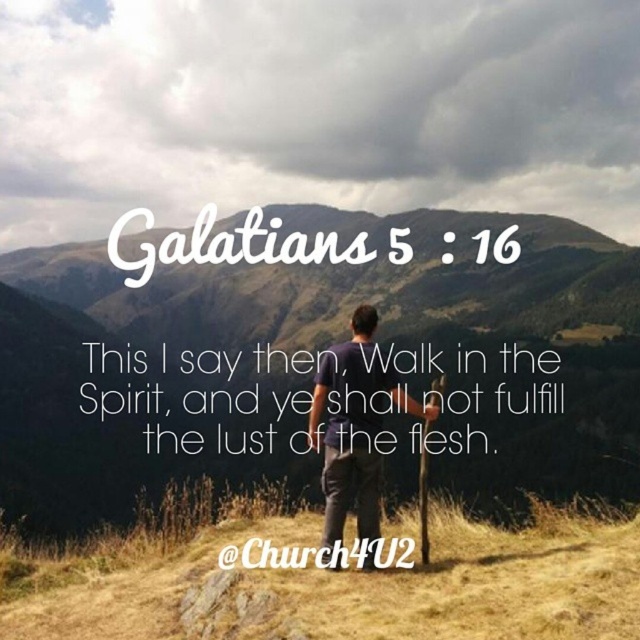
Question: Which object is farther from the camera taking this photo?

Choices:
 (A) dark blue t-shirt at center
 (B) brown grassy hill at center

Answer: (B)

Question: Is brown grassy hill at center above dark blue t-shirt at center?

Choices:
 (A) no
 (B) yes

Answer: (B)

Question: Is brown grassy hill at center smaller than dark blue t-shirt at center?

Choices:
 (A) no
 (B) yes

Answer: (A)

Question: Among these points, which one is nearest to the camera?

Choices:
 (A) (339, 472)
 (B) (209, 349)

Answer: (A)

Question: Which object is farther from the camera taking this photo?

Choices:
 (A) dark blue t-shirt at center
 (B) brown grassy hill at center

Answer: (B)

Question: Is brown grassy hill at center thinner than dark blue t-shirt at center?

Choices:
 (A) no
 (B) yes

Answer: (A)